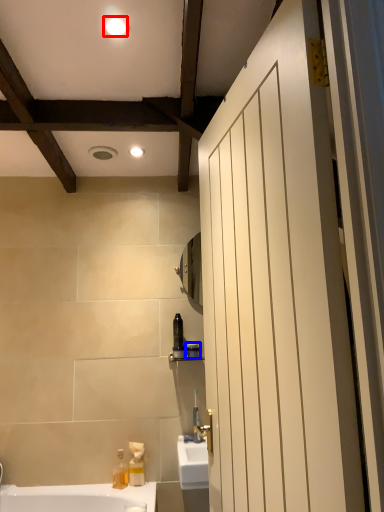
Question: Among these objects, which one is farthest to the camera, light fixture (highlighted by a red box) or toiletry (highlighted by a blue box)?

Choices:
 (A) light fixture
 (B) toiletry

Answer: (B)